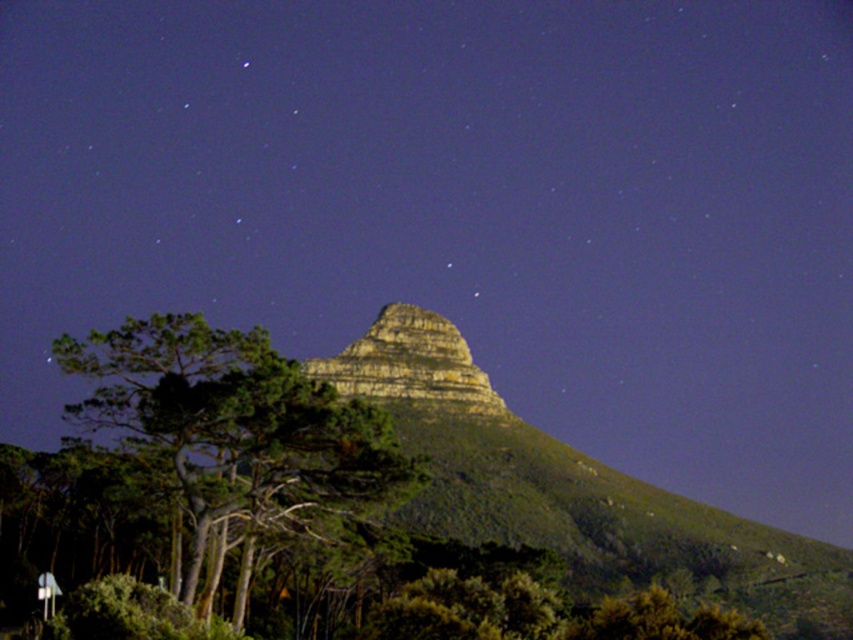
Question: Can you confirm if green matte tree at center-left is positioned above yellowish rock formation at center?

Choices:
 (A) no
 (B) yes

Answer: (A)

Question: Among these objects, which one is nearest to the camera?

Choices:
 (A) green matte tree at center-left
 (B) yellowish rock formation at center

Answer: (A)

Question: Does green matte tree at center-left have a smaller size compared to yellowish rock formation at center?

Choices:
 (A) yes
 (B) no

Answer: (B)

Question: Which point appears closest to the camera in this image?

Choices:
 (A) (178, 472)
 (B) (369, 342)

Answer: (A)

Question: Which object is closer to the camera taking this photo?

Choices:
 (A) yellowish rock formation at center
 (B) green matte tree at center-left

Answer: (B)

Question: Observing the image, what is the correct spatial positioning of green matte tree at center-left in reference to yellowish rock formation at center?

Choices:
 (A) below
 (B) above

Answer: (A)